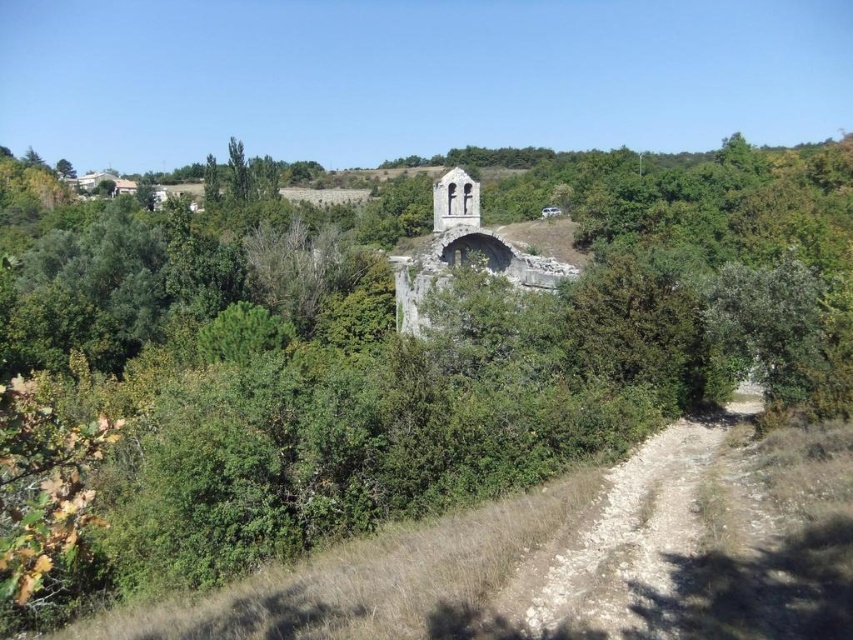
Question: Can you confirm if dirt/gravel path at lower right is positioned below stone tower at center?

Choices:
 (A) yes
 (B) no

Answer: (A)

Question: Is dirt/gravel path at lower right to the left of stone tower at center from the viewer's perspective?

Choices:
 (A) no
 (B) yes

Answer: (A)

Question: Which point is closer to the camera?

Choices:
 (A) (688, 426)
 (B) (448, 179)

Answer: (A)

Question: Which object is closer to the camera taking this photo?

Choices:
 (A) stone tower at center
 (B) dirt/gravel path at lower right

Answer: (B)

Question: Does dirt/gravel path at lower right lie in front of stone tower at center?

Choices:
 (A) no
 (B) yes

Answer: (B)